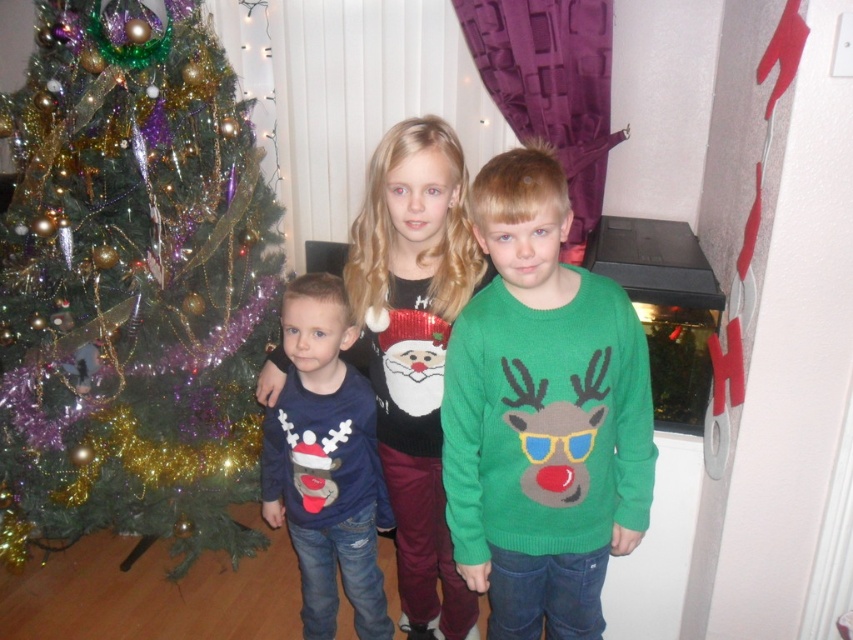
In the festive indoor scene, there is a shiny green christmas tree at left and a green knitted sweater at center. Which object is taller?

The shiny green christmas tree at left is taller than the green knitted sweater at center.

You are a photographer setting up for a group photo of the children in front of the Christmas tree. You need to ensure that both the green knitted sweater at center and the shiny sequin sweater at center are fully visible in the frame. Given that the camera has a fixed width, which child should be positioned closer to the camera to accommodate their sweater widths?

The green knitted sweater at center is wider than the shiny sequin sweater at center. To ensure both sweaters are fully visible, the child wearing the green knitted sweater at center should be positioned closer to the camera since wider objects placed closer to the camera appear larger in the frame, allowing both to fit within the fixed width.